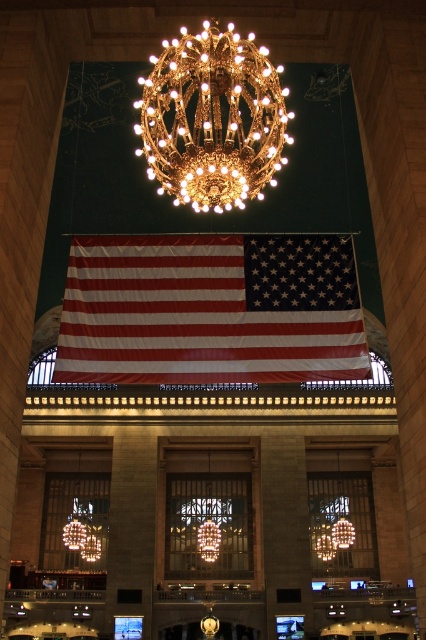
You are an interior designer planning to replace the gold metallic chandelier at upper center with a new one. The new chandelier must be wider than the existing one. However, there is a matte fabric flag at center hanging below it. Will the new chandelier interfere with the flag if placed directly above it?

The matte fabric flag at center is wider than the gold metallic chandelier at upper center. Since the new chandelier must be wider than the existing one, it might still be narrower than the flag, so there could be interference. However, if the new chandelier is wider than the flag, it may not interfere. The exact dimensions are needed to determine this.

You are an interior designer planning to install a new light fixture in the historic building. The current gold metallic chandelier at upper center is above the matte fabric flag at center. If you want to ensure the new light fixture does not cast a shadow on the flag, where should you place it?

The matte fabric flag at center is positioned under the gold metallic chandelier at upper center. To avoid casting a shadow on the flag, the new light fixture should be placed either to the side of the flag or at a different angle so that its light does not directly shine downward onto the flag.